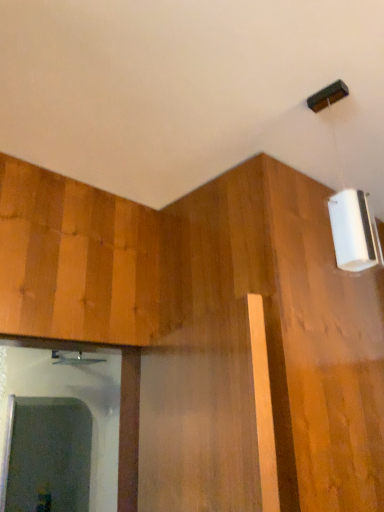
Question: Should I look upward or downward to see black plastic lamp at upper right?

Choices:
 (A) up
 (B) down

Answer: (A)